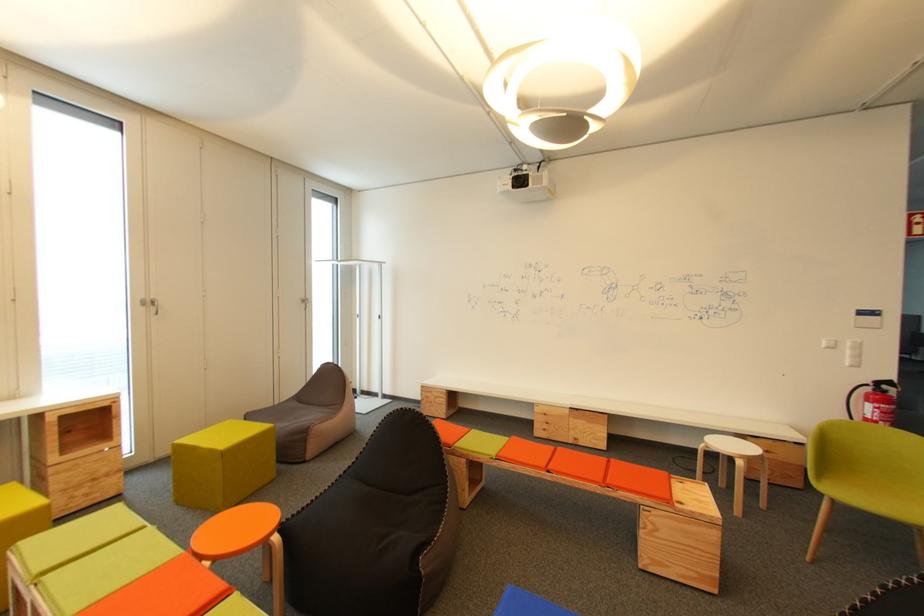
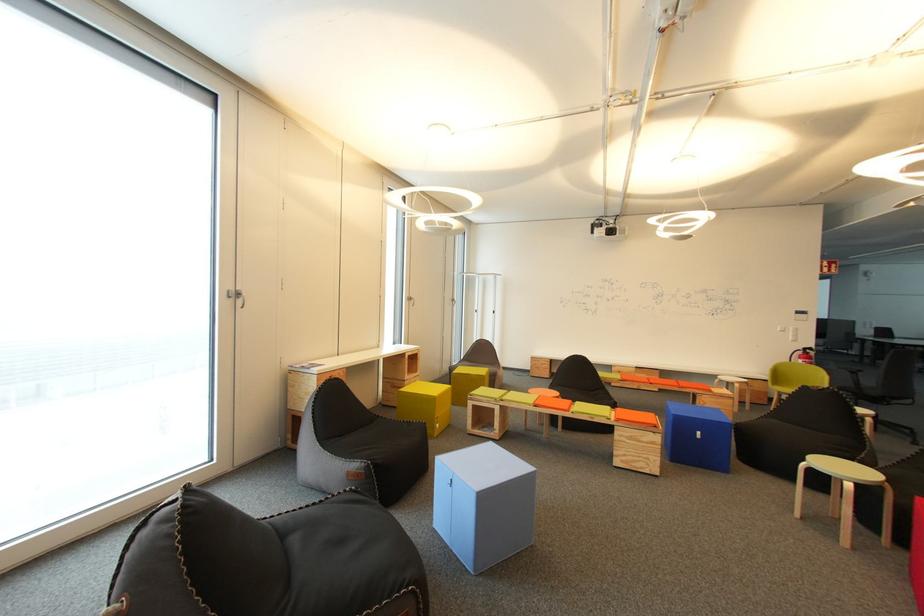
Which direction would the cameraman need to move to produce the second image?

The movement direction of the cameraman is left, backward.